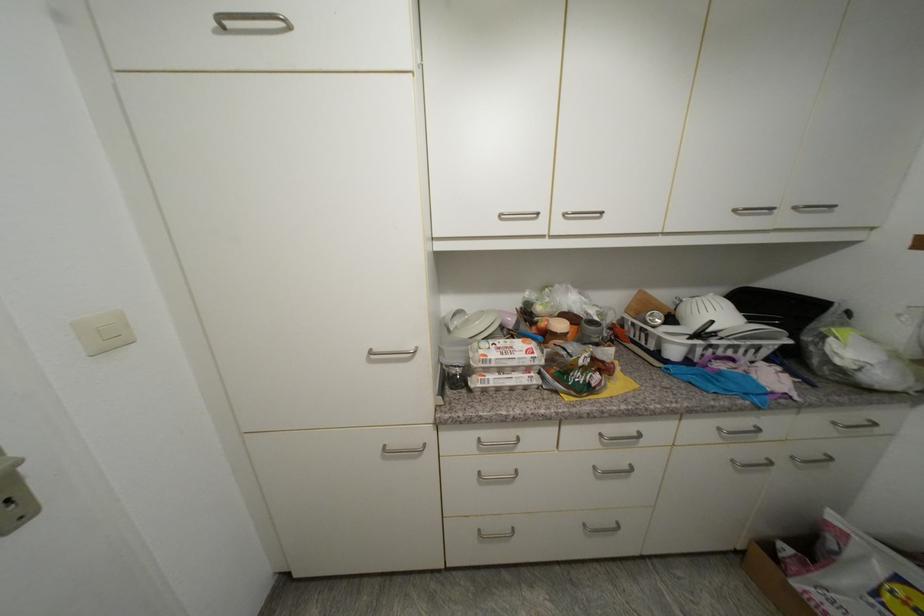
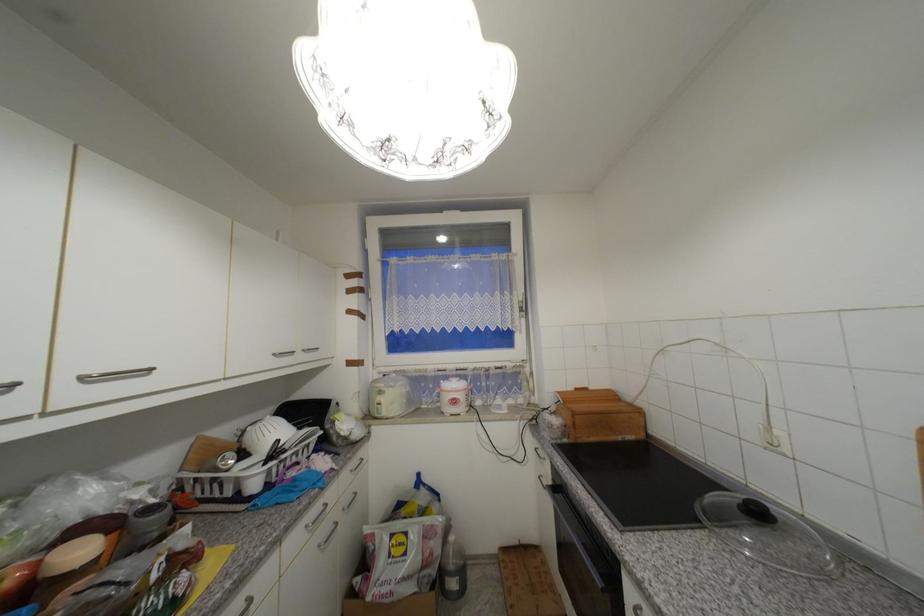
The point at (x=740, y=349) is marked in the first image. Where is the corresponding point in the second image?

(301, 454)